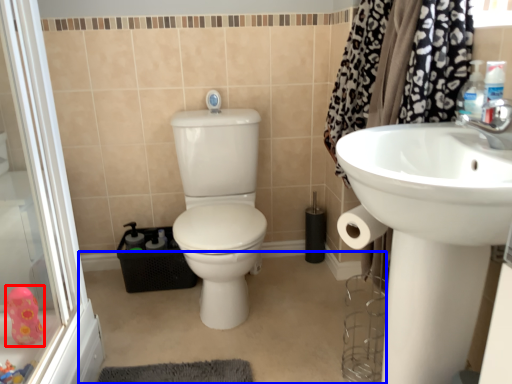
Question: Which object appears farthest to the camera in this image, toy (highlighted by a red box) or plain (highlighted by a blue box)?

Choices:
 (A) toy
 (B) plain

Answer: (A)